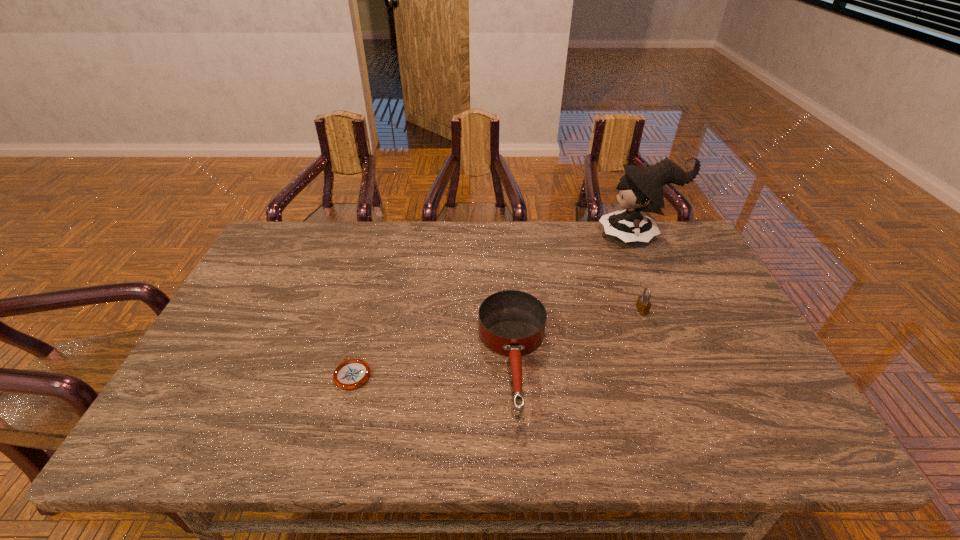
Where is `vacant space at the far right corner of the desktop`? This screenshot has width=960, height=540. vacant space at the far right corner of the desktop is located at coordinates (677, 259).

You are a GUI agent. You are given a task and a screenshot of the screen. Output one action in this format:
    pyautogui.click(x=<x>, y=<y>)
    Task: Click on the vacant area at the near right corner
    The image size is (960, 540).
    Given the screenshot: What is the action you would take?
    pyautogui.click(x=752, y=422)

What are the coordinates of `free space between the second object from left to right and the tallest object` in the screenshot? It's located at (576, 299).

Where is `free space that is in between the second object from left to right and the padlock`? free space that is in between the second object from left to right and the padlock is located at coordinates (578, 335).

Find the location of a particular element. The width and height of the screenshot is (960, 540). vacant point located between the third object from right to left and the compass is located at coordinates (433, 368).

Where is `free spot between the pan and the doll`? Image resolution: width=960 pixels, height=540 pixels. free spot between the pan and the doll is located at coordinates tap(576, 299).

At what (x,y) coordinates should I click in order to perform the action: click on free spot between the farthest object and the third object from right to left. Please return your answer as a coordinate pair (x, y). The width and height of the screenshot is (960, 540). Looking at the image, I should click on (576, 299).

Find the location of a particular element. vacant point located between the third object from right to left and the tallest object is located at coordinates (576, 299).

You are a GUI agent. You are given a task and a screenshot of the screen. Output one action in this format:
    pyautogui.click(x=<x>, y=<y>)
    Task: Click on the vacant space in between the tallest object and the second object from left to right
    This screenshot has height=540, width=960.
    Given the screenshot: What is the action you would take?
    pyautogui.click(x=576, y=299)

Where is `vacant area that lies between the farthest object and the third object from right to left`? This screenshot has width=960, height=540. vacant area that lies between the farthest object and the third object from right to left is located at coordinates click(x=576, y=299).